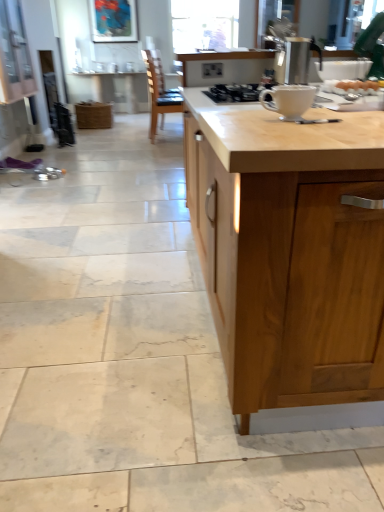
Where is `matte wood cabinet at upper left`? Image resolution: width=384 pixels, height=512 pixels. matte wood cabinet at upper left is located at coordinates (14, 55).

In order to click on transparent glass window at upper center in this screenshot , I will do `click(204, 25)`.

In order to face white glossy mug at center, should I rotate leftwards or rightwards?

To face it directly, rotate right by 12.811 degrees.

The image size is (384, 512). What are the coordinates of `wooden chair at center` in the screenshot? It's located at pyautogui.click(x=159, y=92).

This screenshot has height=512, width=384. What are the coordinates of `metallic silver kettle at upper right` in the screenshot? It's located at (295, 60).

Which is behind, matte wood cabinet at upper left or light wood countertop at center?

matte wood cabinet at upper left is behind.

Can you confirm if matte wood cabinet at upper left is bigger than light wood countertop at center?

Incorrect, matte wood cabinet at upper left is not larger than light wood countertop at center.

Consider the image. Would you say matte wood cabinet at upper left is to the left or to the right of light wood countertop at center in the picture?

Clearly, matte wood cabinet at upper left is on the left of light wood countertop at center in the image.

Does transparent glass window at upper center have a greater height compared to light wood countertop at center?

Indeed, transparent glass window at upper center has a greater height compared to light wood countertop at center.

Is light wood countertop at center located within transparent glass window at upper center?

No, light wood countertop at center is not a part of transparent glass window at upper center.

From the picture: Measure the distance from transparent glass window at upper center to light wood countertop at center.

They are 4.88 meters apart.

Is transparent glass window at upper center at the right side of light wood countertop at center?

Incorrect, transparent glass window at upper center is not on the right side of light wood countertop at center.

From a real-world perspective, which is physically above, wooden chair at center or white glossy gas stove at center?

white glossy gas stove at center, from a real-world perspective.

Can you tell me how much wooden chair at center and white glossy gas stove at center differ in facing direction?

wooden chair at center and white glossy gas stove at center are facing 176 degrees away from each other.

Is wooden chair at center surrounding white glossy gas stove at center?

No, white glossy gas stove at center is located outside of wooden chair at center.

Which of these two, wooden chair at center or white glossy gas stove at center, is thinner?

white glossy gas stove at center.

Based on the photo, is transparent glass window at upper center positioned with its back to wooden chair at center?

No.

Considering the sizes of objects transparent glass window at upper center and wooden chair at center in the image provided, who is bigger, transparent glass window at upper center or wooden chair at center?

wooden chair at center.

How different are the orientations of transparent glass window at upper center and wooden chair at center in degrees?

The angular difference between transparent glass window at upper center and wooden chair at center is 93.4 degrees.

Considering the points (205, 42) and (309, 101), which point is in front, point (205, 42) or point (309, 101)?

The point (309, 101) is closer.

Does transparent glass window at upper center come behind white glossy mug at center?

Yes.

How far apart are transparent glass window at upper center and white glossy mug at center?

4.60 meters.

From the image's perspective, which one is positioned lower, transparent glass window at upper center or white glossy mug at center?

white glossy mug at center is shown below in the image.

Which object is further away from the camera, white glossy mug at center or light wood countertop at center?

white glossy mug at center is more distant.

From the image's perspective, is white glossy mug at center located above or below light wood countertop at center?

Answer: From the image's perspective, white glossy mug at center appears below light wood countertop at center.

Considering the sizes of white glossy mug at center and light wood countertop at center in the image, is white glossy mug at center taller or shorter than light wood countertop at center?

Clearly, white glossy mug at center is shorter compared to light wood countertop at center.

From a real-world perspective, is white glossy mug at center positioned above or below white glossy gas stove at center?

Clearly, from a real-world perspective, white glossy mug at center is above white glossy gas stove at center.

From the image's perspective, is white glossy mug at center on white glossy gas stove at center?

No, from the image's perspective, white glossy mug at center is not over white glossy gas stove at center.

Considering the relative positions of white glossy mug at center and white glossy gas stove at center in the image provided, is white glossy mug at center to the right of white glossy gas stove at center from the viewer's perspective?

No.

Between white glossy mug at center and white glossy gas stove at center, which one is positioned behind?

white glossy gas stove at center is more distant.

This screenshot has height=512, width=384. What are the coordinates of `cabinetry on the left of light wood countertop at center` in the screenshot? It's located at (14, 55).

You are a GUI agent. You are given a task and a screenshot of the screen. Output one action in this format:
    pyautogui.click(x=<x>, y=<y>)
    Task: Click on the window screen that is behind the light wood countertop at center
    The image size is (384, 512).
    Given the screenshot: What is the action you would take?
    pyautogui.click(x=204, y=25)

Looking at the image, which one is located further to wooden chair at center, white glossy gas stove at center or metallic silver kettle at upper right?

white glossy gas stove at center is positioned further to the anchor wooden chair at center.

Considering their positions, is matte white table at center positioned further to matte wood cabinet at upper left than white glossy mug at center?

Based on the image, white glossy mug at center appears to be further to matte wood cabinet at upper left.

Looking at the image, which one is located closer to matte white table at center, wooden chair at center or light wood countertop at center?

wooden chair at center.

Looking at the image, which one is located further to matte white table at center, transparent glass window at upper center or white glossy mug at center?

Based on the image, white glossy mug at center appears to be further to matte white table at center.

Considering their positions, is white glossy mug at center positioned closer to matte wood cabinet at upper left than wooden chair at center?

Based on the image, wooden chair at center appears to be nearer to matte wood cabinet at upper left.

When comparing their distances from transparent glass window at upper center, does white glossy gas stove at center or metallic silver kettle at upper right seem closer?

metallic silver kettle at upper right is closer to transparent glass window at upper center.

When comparing their distances from white glossy gas stove at center, does wooden chair at center or matte white table at center seem further?

matte white table at center is further to white glossy gas stove at center.

Estimate the real-world distances between objects in this image. Which object is closer to matte white table at center, white glossy mug at center or white glossy gas stove at center?

white glossy gas stove at center.

Where is `chair between white glossy mug at center and transparent glass window at upper center from front to back`? chair between white glossy mug at center and transparent glass window at upper center from front to back is located at coordinates (159, 92).

Locate an element on the screen. This screenshot has height=512, width=384. gas stove between metallic silver kettle at upper right and matte white table at center from front to back is located at coordinates (236, 92).

Image resolution: width=384 pixels, height=512 pixels. I want to click on chair positioned between light wood countertop at center and matte white table at center from near to far, so click(x=159, y=92).

Find the location of a particular element. table located between matte wood cabinet at upper left and transparent glass window at upper center in the depth direction is located at coordinates (111, 90).